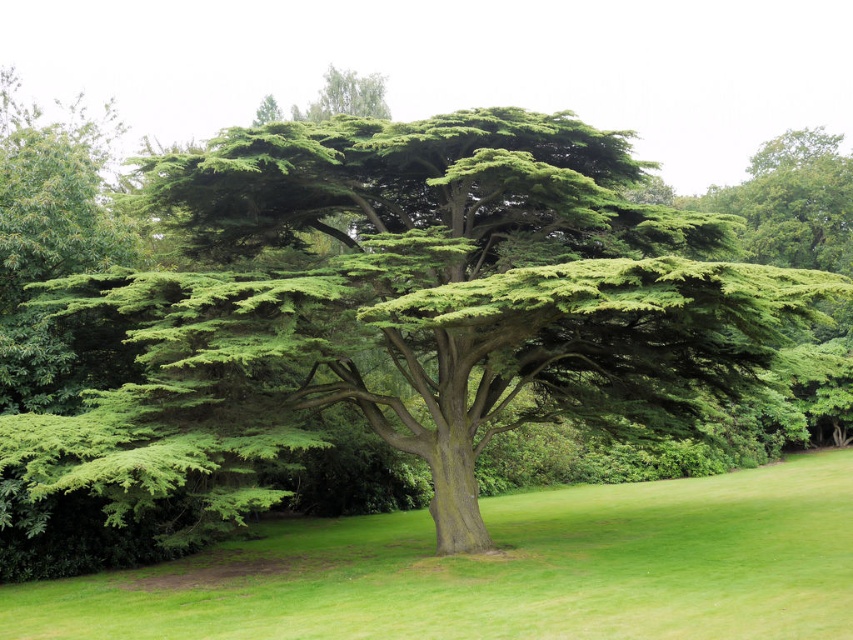
Between point (462, 420) and point (811, 580), which one is positioned in front?

Point (811, 580) is in front.

Is green textured tree at center taller than green grass at center?

Yes, green textured tree at center is taller than green grass at center.

Between point (422, 384) and point (747, 499), which one is positioned in front?

Positioned in front is point (422, 384).

Image resolution: width=853 pixels, height=640 pixels. I want to click on green textured tree at center, so click(404, 307).